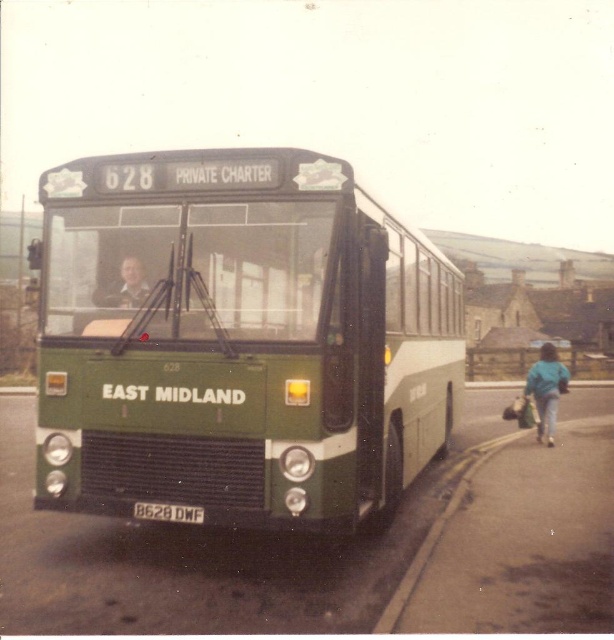
Question: Can you confirm if blue fabric jacket at lower right is positioned to the right of matte green face at center?

Choices:
 (A) no
 (B) yes

Answer: (B)

Question: Does green matte bus at center have a lesser width compared to yellow painted concrete curb at lower right?

Choices:
 (A) yes
 (B) no

Answer: (B)

Question: Can you confirm if yellow painted concrete curb at lower right is thinner than blue fabric jacket at lower right?

Choices:
 (A) no
 (B) yes

Answer: (B)

Question: Which point is farther to the camera?

Choices:
 (A) red plastic license plate at center
 (B) yellow painted concrete curb at lower right
 (C) matte green face at center

Answer: (C)

Question: Which object is positioned farthest from the green matte bus at center?

Choices:
 (A) red plastic license plate at center
 (B) matte green face at center

Answer: (A)

Question: Which of these objects is positioned farthest from the blue fabric jacket at lower right?

Choices:
 (A) green matte bus at center
 (B) red plastic license plate at center
 (C) yellow painted concrete curb at lower right

Answer: (B)